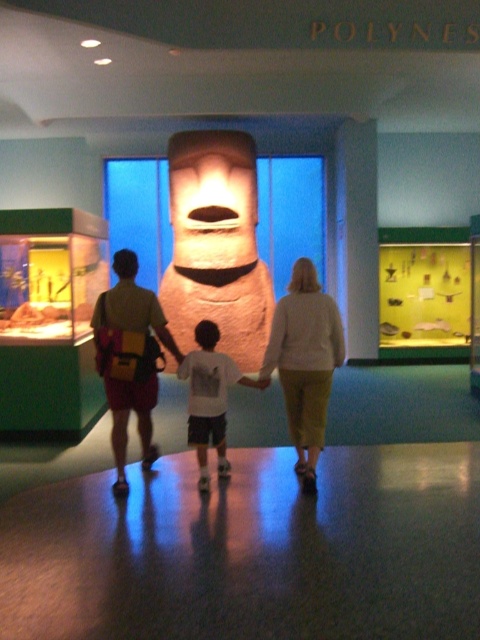
Question: Is matte stone statue at center further to camera compared to yellow backpack at center?

Choices:
 (A) no
 (B) yes

Answer: (B)

Question: Which point is farther from the camera taking this photo?

Choices:
 (A) (135, 348)
 (B) (122, 337)
 (C) (206, 332)
 (D) (315, 356)

Answer: (C)

Question: Estimate the real-world distances between objects in this image. Which object is farther from the matte stone statue at center?

Choices:
 (A) white cotton shirt at center
 (B) yellow backpack at center
 (C) light beige sweater at center

Answer: (C)

Question: Is the position of light beige sweater at center more distant than that of white cotton shirt at center?

Choices:
 (A) no
 (B) yes

Answer: (A)

Question: Is yellow backpack at center positioned in front of white cotton shirt at center?

Choices:
 (A) no
 (B) yes

Answer: (B)

Question: Estimate the real-world distances between objects in this image. Which object is farther from the light beige sweater at center?

Choices:
 (A) white cotton shirt at center
 (B) matte stone statue at center
 (C) yellow backpack at center

Answer: (C)